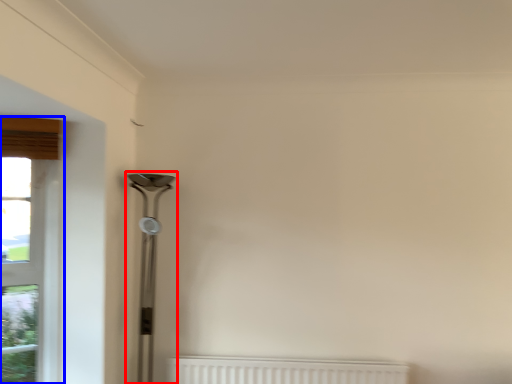
Question: Among these objects, which one is farthest to the camera, table lamp (highlighted by a red box) or window (highlighted by a blue box)?

Choices:
 (A) table lamp
 (B) window

Answer: (A)